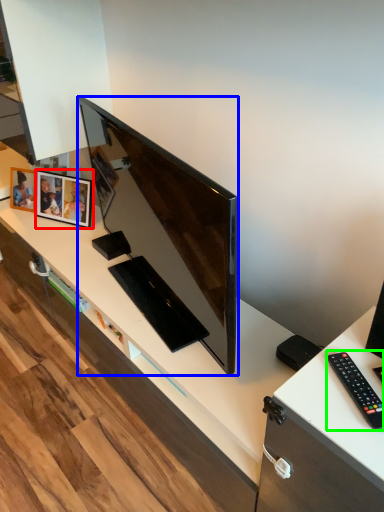
Question: Which is nearer to the picture frame (highlighted by a red box)? television (highlighted by a blue box) or remote control (highlighted by a green box).

Choices:
 (A) television
 (B) remote control

Answer: (A)